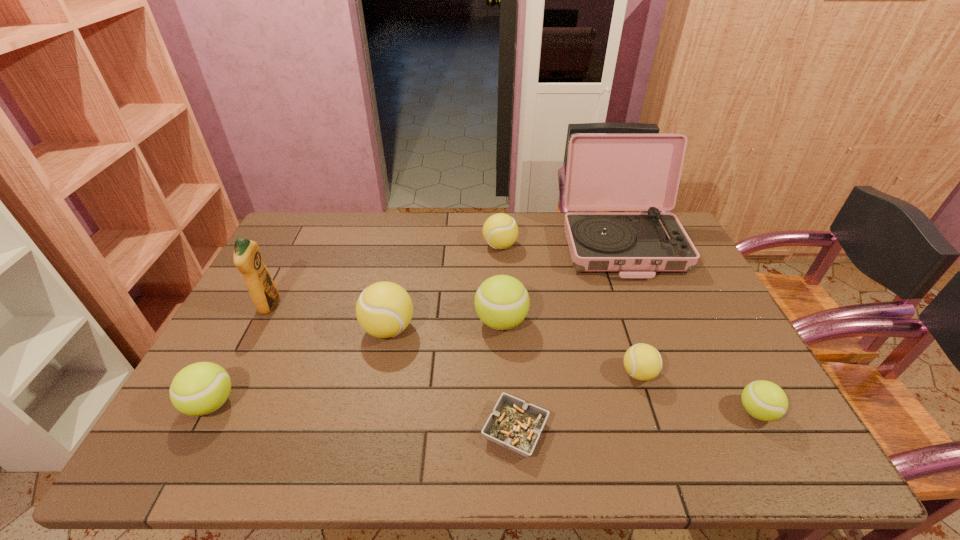
You are a GUI agent. You are given a task and a screenshot of the screen. Output one action in this format:
    pyautogui.click(x=<x>, y=<y>)
    Task: Click on the rightmost tennis ball
    The image size is (960, 540).
    Given the screenshot: What is the action you would take?
    pyautogui.click(x=764, y=400)

Identify the location of the smallest green tennis ball. The width and height of the screenshot is (960, 540). (764, 400).

The image size is (960, 540). I want to click on the smallest yellow tennis ball, so click(x=643, y=362).

This screenshot has width=960, height=540. What are the coordinates of `the nearest yellow tennis ball` in the screenshot? It's located at (643, 362).

You are a GUI agent. You are given a task and a screenshot of the screen. Output one action in this format:
    pyautogui.click(x=<x>, y=<y>)
    Task: Click on the shortest object
    
    Given the screenshot: What is the action you would take?
    pyautogui.click(x=514, y=424)

Where is `gray ashtray`? gray ashtray is located at coordinates (514, 424).

Locate an element on the screen. The width and height of the screenshot is (960, 540). free point located with the lid open on the record player is located at coordinates (664, 353).

This screenshot has width=960, height=540. I want to click on free region located 0.250m on the label of the detergent, so click(x=364, y=306).

This screenshot has width=960, height=540. I want to click on vacant region located 0.250m on the front of the second nearest yellow tennis ball, so click(366, 438).

I want to click on vacant area located on the back of the farthest green tennis ball, so click(496, 227).